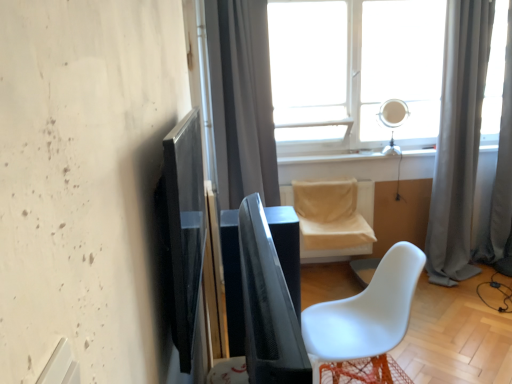
Question: From the image's perspective, is transparent glass window at upper center positioned above or below white matte chair at lower right, the second chair positioned from the back?

Choices:
 (A) above
 (B) below

Answer: (A)

Question: Considering the positions of transparent glass window at upper center and white matte chair at lower right, the second chair positioned from the back, in the image, is transparent glass window at upper center taller or shorter than white matte chair at lower right, the second chair positioned from the back,?

Choices:
 (A) short
 (B) tall

Answer: (B)

Question: Estimate the real-world distances between objects in this image. Which object is closer to the gray fabric curtain at right, which is the 2th curtain from right to left?

Choices:
 (A) white matte chair at lower right, which ranks as the first chair in front-to-back order
 (B) gray fabric curtain at upper center, arranged as the first curtain when viewed from the left
 (C) transparent glass window at upper center
 (D) black glossy speaker at center
 (E) beige fabric chair at center, the second chair in the front-to-back sequence

Answer: (C)

Question: Based on their relative distances, which object is farther from the black glossy speaker at center?

Choices:
 (A) gray fabric curtain at right, which is the 2th curtain from right to left
 (B) white matte chair at lower right, which ranks as the first chair in front-to-back order
 (C) beige fabric chair at center, the second chair in the front-to-back sequence
 (D) black glossy screen door at left
 (E) transparent glass window at upper center

Answer: (A)